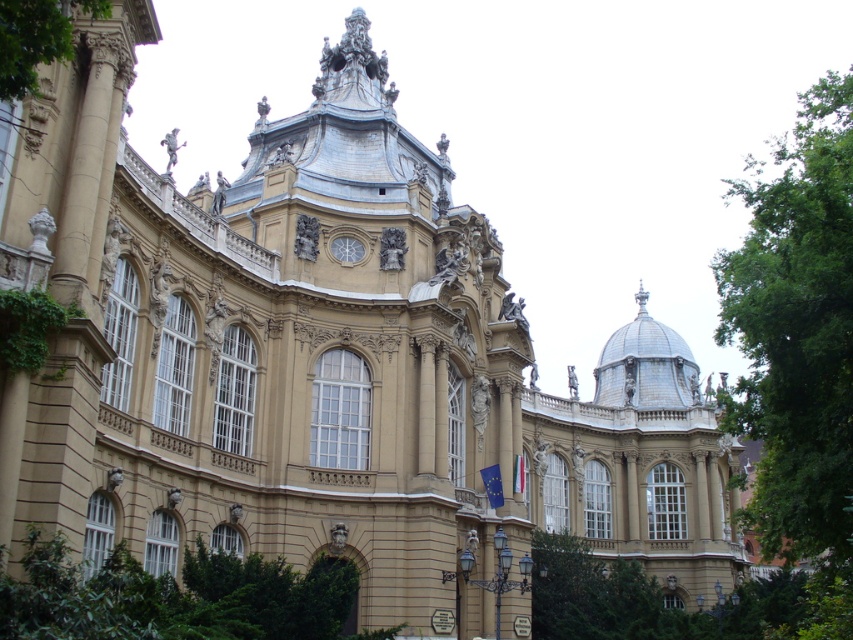
Question: Does green leafy tree at lower center have a lesser width compared to green leafy tree at lower right?

Choices:
 (A) yes
 (B) no

Answer: (A)

Question: Where is green leafy tree at right located in relation to green leafy tree at upper left in the image?

Choices:
 (A) right
 (B) left

Answer: (A)

Question: Considering the relative positions of green leafy tree at lower center and green leafy tree at lower right in the image provided, where is green leafy tree at lower center located with respect to green leafy tree at lower right?

Choices:
 (A) right
 (B) left

Answer: (B)

Question: Which point appears closest to the camera in this image?

Choices:
 (A) (53, 637)
 (B) (770, 205)
 (C) (54, 54)

Answer: (A)

Question: Which point is farther from the camera taking this photo?

Choices:
 (A) (167, 632)
 (B) (614, 602)

Answer: (B)

Question: Estimate the real-world distances between objects in this image. Which object is farther from the green leafy tree at upper left?

Choices:
 (A) green leafy tree at lower center
 (B) green leafy tree at right
 (C) green leafy tree at lower right

Answer: (C)